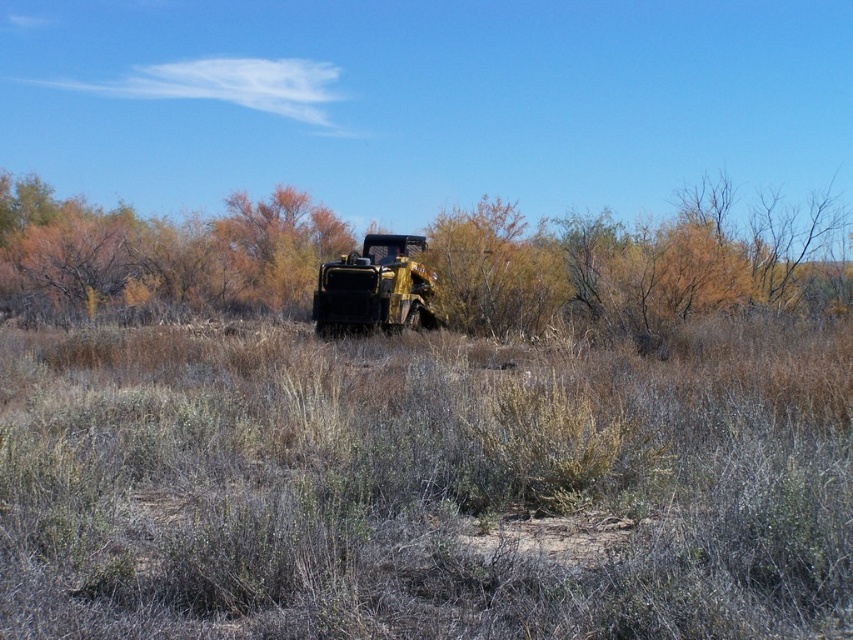
You are a hiker trying to cross through the dry grass at center and the brown textured shrub at center. Which one is shorter and easier to step over?

The dry grass at center is not as tall as the brown textured shrub at center, so the dry grass at center is shorter and easier to step over.

From the picture: You are a photographer planning to capture a wide shot of the metallic yellow jeep at center. Considering the brown textured shrub at center is in the frame, will the shrub appear wider than the jeep in the photo?

The brown textured shrub at center is wider than the metallic yellow jeep at center, so yes, the shrub will appear wider than the jeep in the photo.

You are a hiker trying to navigate through the dry vegetation in the foreground. There is a point marked at coordinates point (424, 483). Can you determine if this point is located within the dry grass at center?

The point (424, 483) is part of the dry grass at center, so yes, it is located within the dry grass at center.